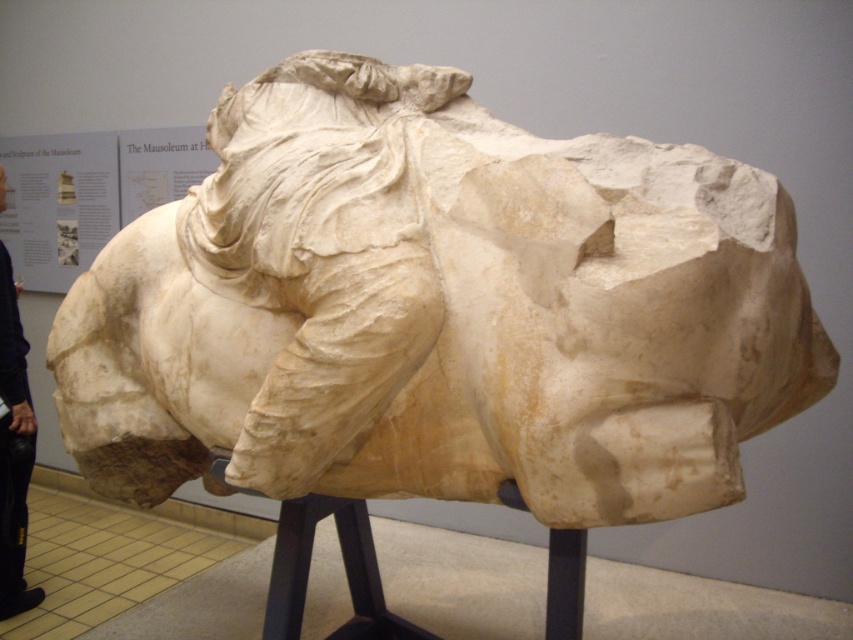
From the picture: You are an art conservator assessing the spatial arrangement of the sculpture display. The white marble horse at center and black leather pants at lower left are part of the exhibit. Based on their sizes, which object would require a taller storage container for preservation?

The black leather pants at lower left would require a taller storage container since the white marble horse at center is not as tall as the black leather pants at lower left.